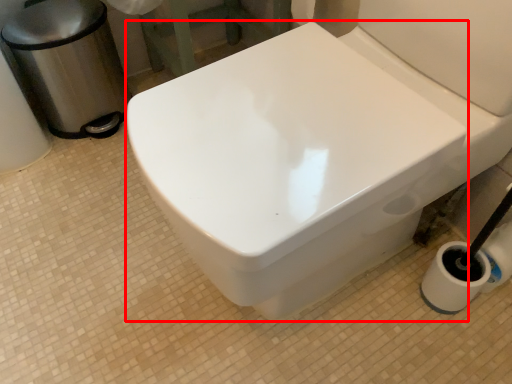
Question: From the image's perspective, what is the correct spatial positioning of bidet (annotated by the red box) in reference to garbage?

Choices:
 (A) below
 (B) above

Answer: (A)